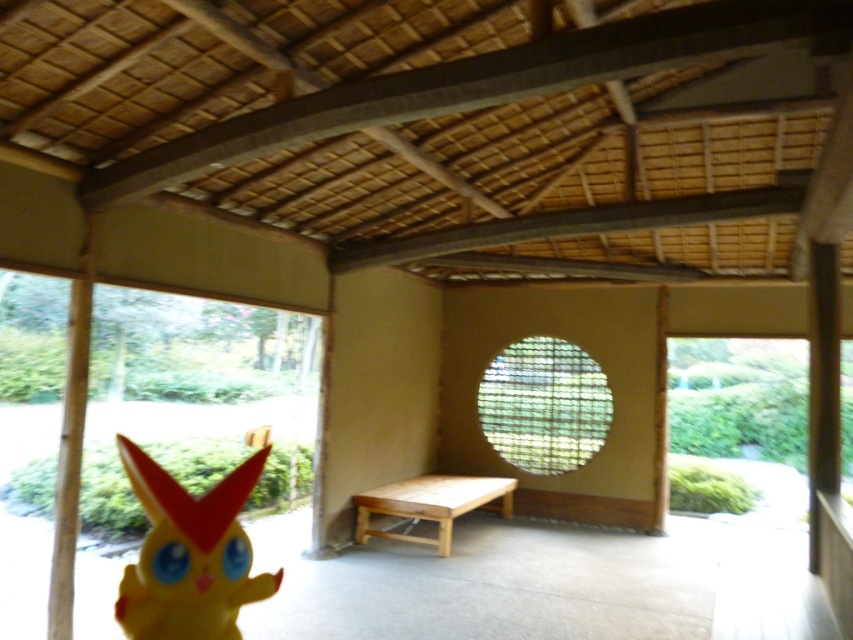
Does yellow matte plush at lower left have a lesser width compared to wooden bench at center?

Yes, yellow matte plush at lower left is thinner than wooden bench at center.

Who is lower down, yellow matte plush at lower left or wooden bench at center?

wooden bench at center is below.

Between point (200, 593) and point (369, 492), which one is positioned behind?

The point (369, 492) is more distant.

Identify the location of yellow matte plush at lower left. (189, 554).